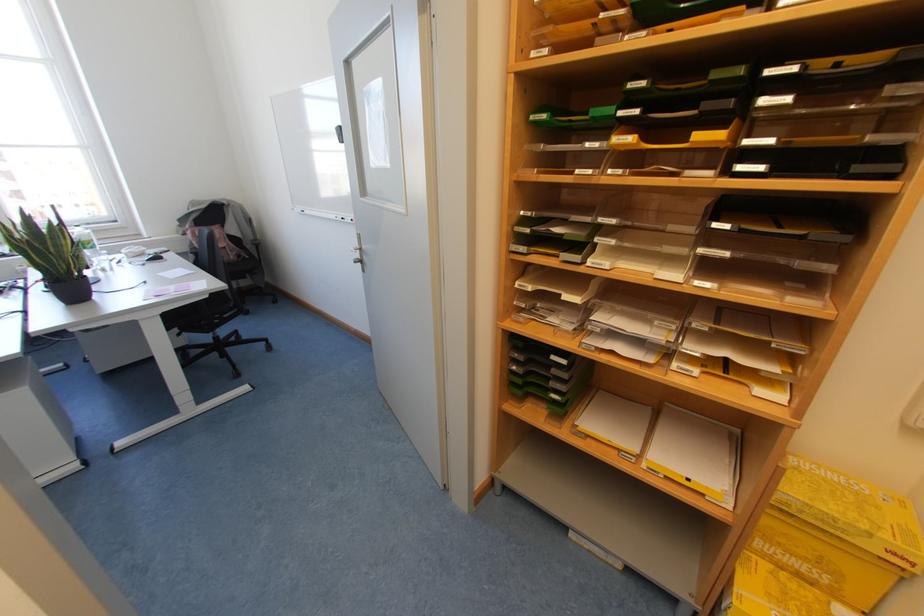
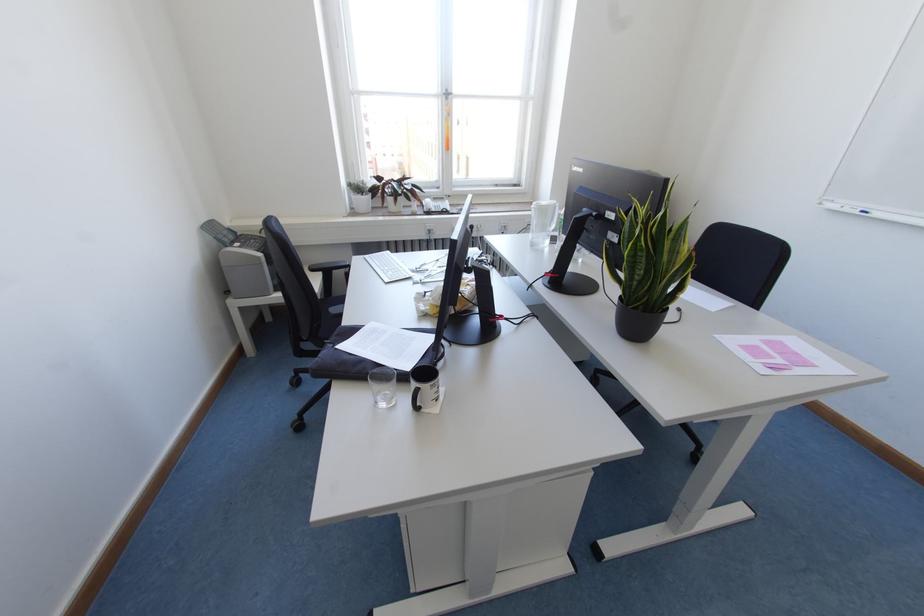
Locate, in the second image, the point that corresponds to point 302,211 in the first image.

(864, 213)